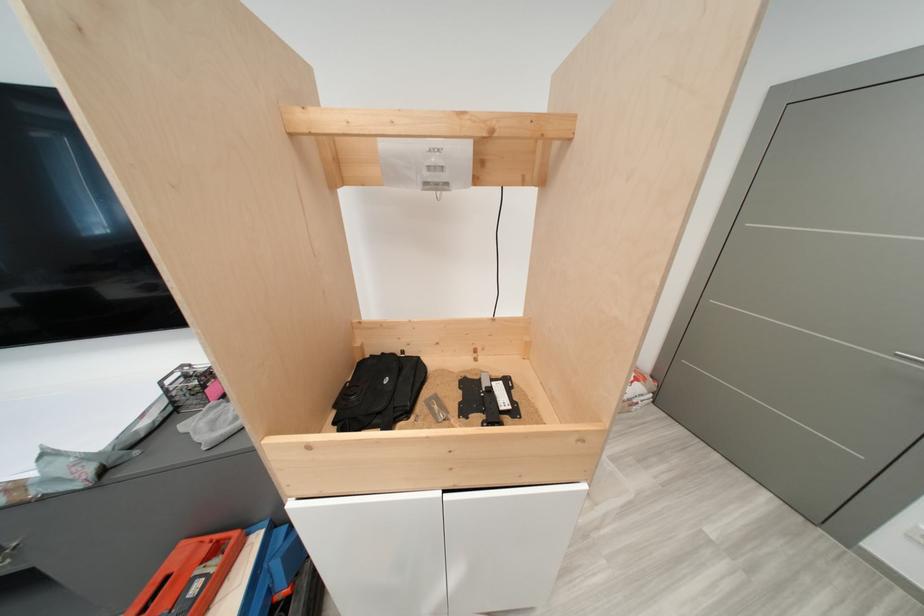
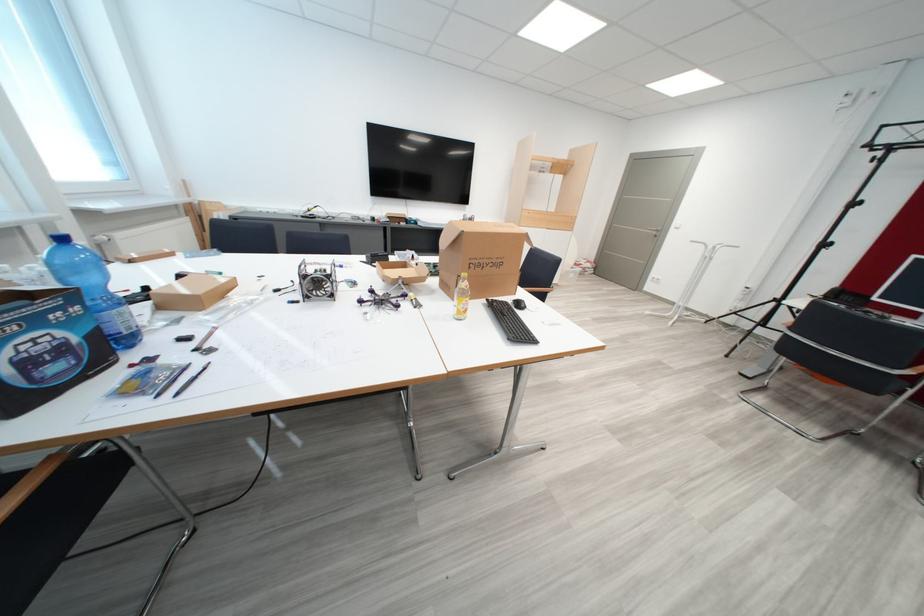
Where in the second image is the point corresponding to [455,493] from the first image?

(556, 232)